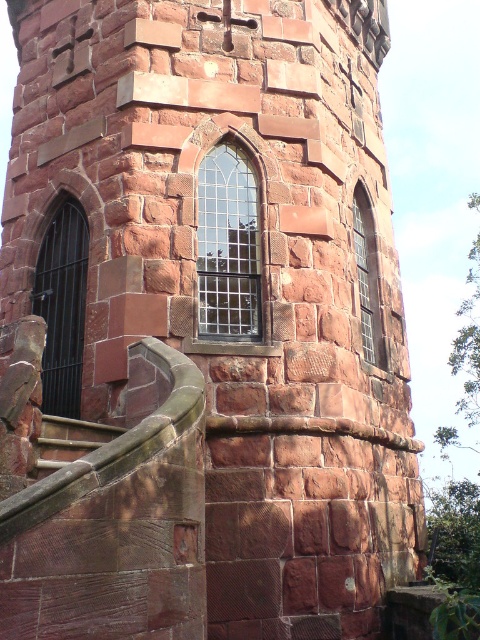
You are an architect examining the stone tower. You notice a point at coordinates (228, 244). What object is located at this point?

The point at coordinates (228, 244) is occupied by the clear glass window at center.

You are standing at the base of the stone tower and want to look through the clear glass window at center. Are the brown stone stairs at lower left in your way?

The clear glass window at center is above the brown stone stairs at lower left, so the stairs are below the window and not blocking your view. You can look through the clear glass window at center without obstruction from the stairs.